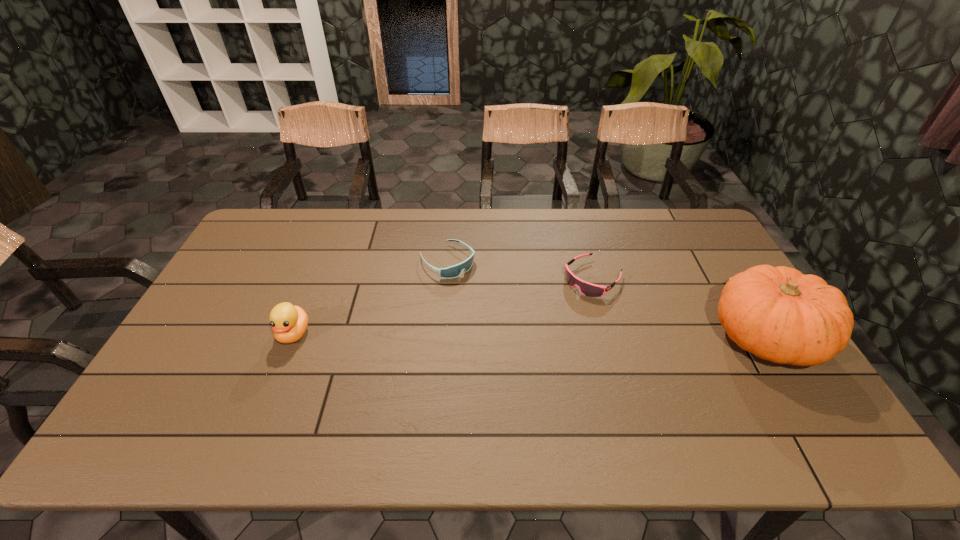
Locate an element on the screen. free space between the duckling and the right goggles is located at coordinates (444, 306).

Where is `unoccupied area between the leftmost object and the right goggles`? The image size is (960, 540). unoccupied area between the leftmost object and the right goggles is located at coordinates (x=444, y=306).

Identify the location of vacant space that's between the third object from right to left and the rightmost object. This screenshot has width=960, height=540. (607, 299).

In order to click on empty space between the right goggles and the second object from left to right in this screenshot , I will do `click(520, 269)`.

Identify which object is located as the nearest to the second object from left to right. Please provide its 2D coordinates. Your answer should be formatted as a tuple, i.e. [(x, y)], where the tuple contains the x and y coordinates of a point satisfying the conditions above.

[(588, 289)]

Identify the location of the third closest object relative to the third object from left to right. The width and height of the screenshot is (960, 540). (289, 323).

Image resolution: width=960 pixels, height=540 pixels. What are the coordinates of `vacant region that satisfies the following two spatial constraints: 1. on the face of the pumpkin; 2. on the right side of the second tallest object` in the screenshot? It's located at (293, 337).

The width and height of the screenshot is (960, 540). Find the location of `free point that satisfies the following two spatial constraints: 1. on the face of the tallest object; 2. on the left side of the second tallest object`. free point that satisfies the following two spatial constraints: 1. on the face of the tallest object; 2. on the left side of the second tallest object is located at coordinates (293, 337).

At what (x,y) coordinates should I click in order to perform the action: click on free space that satisfies the following two spatial constraints: 1. on the front side of the rightmost object; 2. on the right side of the second object from left to right. Please return your answer as a coordinate pair (x, y). The height and width of the screenshot is (540, 960). Looking at the image, I should click on (442, 337).

I want to click on blank area in the image that satisfies the following two spatial constraints: 1. on the face of the second tallest object; 2. on the left side of the tallest object, so click(x=293, y=337).